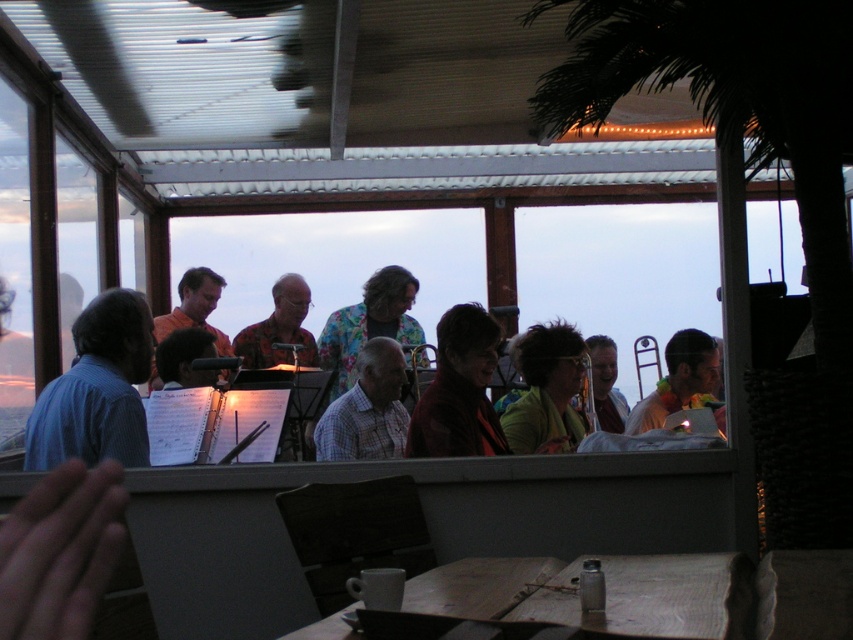
Does matte red jacket at center have a lesser height compared to matte black laptop at right?

In fact, matte red jacket at center may be taller than matte black laptop at right.

Between matte red jacket at center and matte black laptop at right, which one has more height?

matte red jacket at center is taller.

Describe the element at coordinates (459, 390) in the screenshot. This screenshot has width=853, height=640. I see `matte red jacket at center` at that location.

The image size is (853, 640). Find the location of `matte red jacket at center`. matte red jacket at center is located at coordinates (459, 390).

Does wooden table at center have a larger size compared to matte black laptop at right?

Incorrect, wooden table at center is not larger than matte black laptop at right.

Is the position of wooden table at center more distant than that of matte black laptop at right?

No, it is in front of matte black laptop at right.

Consider the image. Who is more distant from viewer, (572, 582) or (653, 417)?

Positioned behind is point (653, 417).

The image size is (853, 640). What are the coordinates of `wooden table at center` in the screenshot? It's located at (646, 595).

Which is behind, point (364, 445) or point (648, 420)?

Point (648, 420)

Does checkered fabric shirt at center have a lesser width compared to matte black laptop at right?

Yes, checkered fabric shirt at center is thinner than matte black laptop at right.

Does point (366, 376) come closer to viewer compared to point (695, 394)?

That is True.

You are a GUI agent. You are given a task and a screenshot of the screen. Output one action in this format:
    pyautogui.click(x=<x>, y=<y>)
    Task: Click on the checkered fabric shirt at center
    
    Given the screenshot: What is the action you would take?
    pyautogui.click(x=367, y=410)